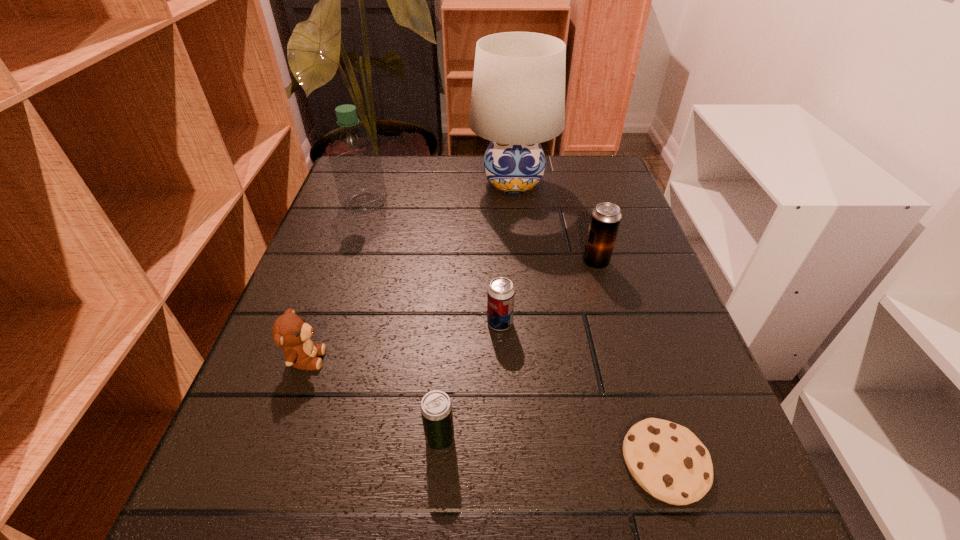
Where is `vacant space situated 0.220m on the front-facing side of the tallest object`? The image size is (960, 540). vacant space situated 0.220m on the front-facing side of the tallest object is located at coordinates (522, 268).

Identify the location of free space located on the front of the water bottle. Image resolution: width=960 pixels, height=540 pixels. (319, 339).

Where is `vacant space situated 0.130m on the back of the farthest beer can`? vacant space situated 0.130m on the back of the farthest beer can is located at coordinates (583, 218).

Locate an element on the screen. The width and height of the screenshot is (960, 540). vacant area located on the face of the teddy bear is located at coordinates (446, 359).

Where is `free point located on the left of the second beer can from left to right`? This screenshot has width=960, height=540. free point located on the left of the second beer can from left to right is located at coordinates (290, 323).

At what (x,y) coordinates should I click in order to perform the action: click on vacant space located on the back of the leftmost beer can. Please return your answer as a coordinate pair (x, y). Looking at the image, I should click on (449, 301).

I want to click on vacant area located on the back of the cookie, so click(602, 258).

Where is `lampshade that is at the far edge`? The image size is (960, 540). lampshade that is at the far edge is located at coordinates (518, 93).

Find the location of `water bottle at the far edge`. water bottle at the far edge is located at coordinates (355, 158).

Locate an element on the screen. object situated at the near edge is located at coordinates pyautogui.click(x=667, y=460).